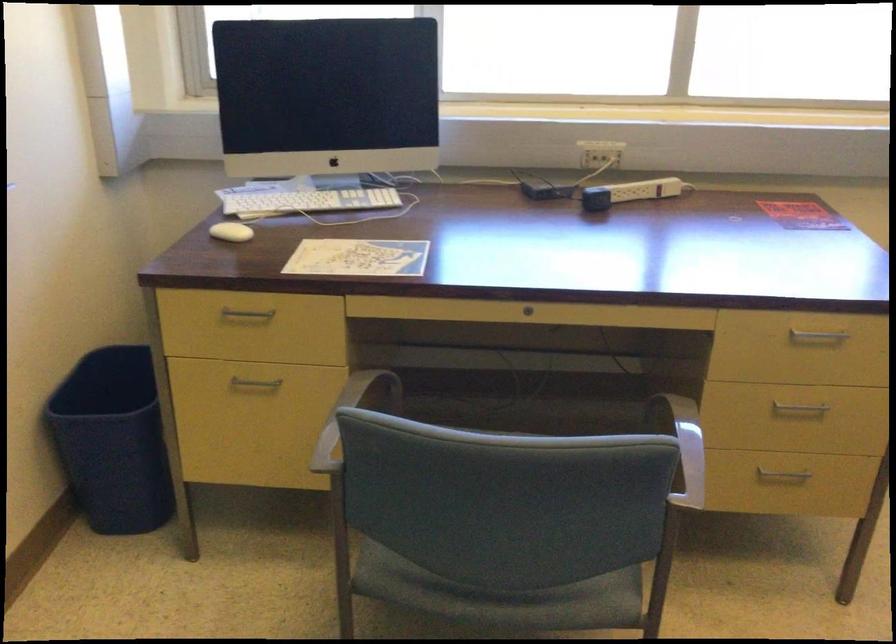
This screenshot has height=644, width=896. Identify the location of chair sitting surface. (502, 597).